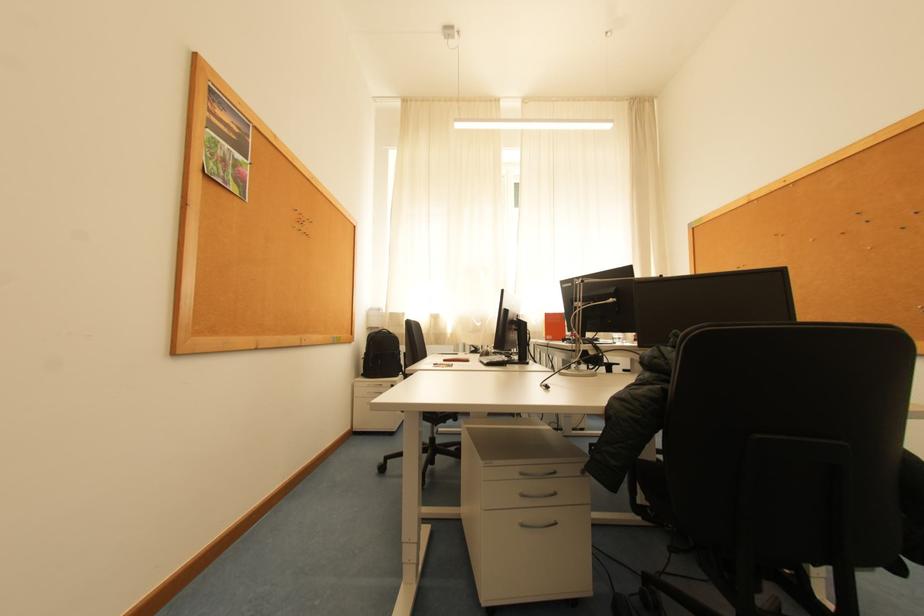
Describe the element at coordinates (537, 474) in the screenshot. I see `the silver drawer handle` at that location.